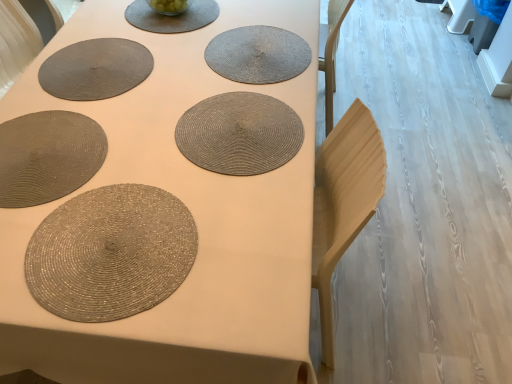
At what (x,y) coordinates should I click in order to perform the action: click on vacant area that lies between rattan placemat at center, the first coaster ordered from the bottom, and rattan placemat at lower left, the second paper plate viewed from the top. Please return your answer as a coordinate pair (x, y). This screenshot has width=512, height=384. Looking at the image, I should click on (138, 143).